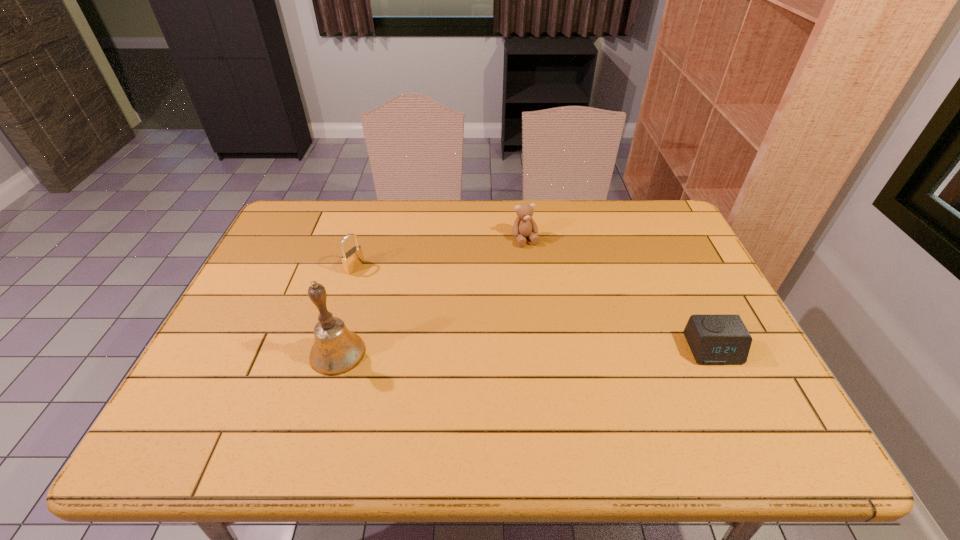
Image resolution: width=960 pixels, height=540 pixels. What are the coordinates of `free point between the rightmost object and the tallest object` in the screenshot? It's located at click(525, 351).

This screenshot has height=540, width=960. What are the coordinates of `vacant area that lies between the alarm clock and the third object from left to right` in the screenshot? It's located at click(x=618, y=294).

Locate an element on the screen. This screenshot has width=960, height=540. free space between the farthest object and the alarm clock is located at coordinates (618, 294).

Image resolution: width=960 pixels, height=540 pixels. Find the location of `free space between the tallest object and the second farthest object`. free space between the tallest object and the second farthest object is located at coordinates (347, 310).

Where is `object identified as the second closest to the tallest object`? object identified as the second closest to the tallest object is located at coordinates (524, 226).

Locate an element on the screen. This screenshot has height=540, width=960. the closest object to the second object from right to left is located at coordinates point(353,259).